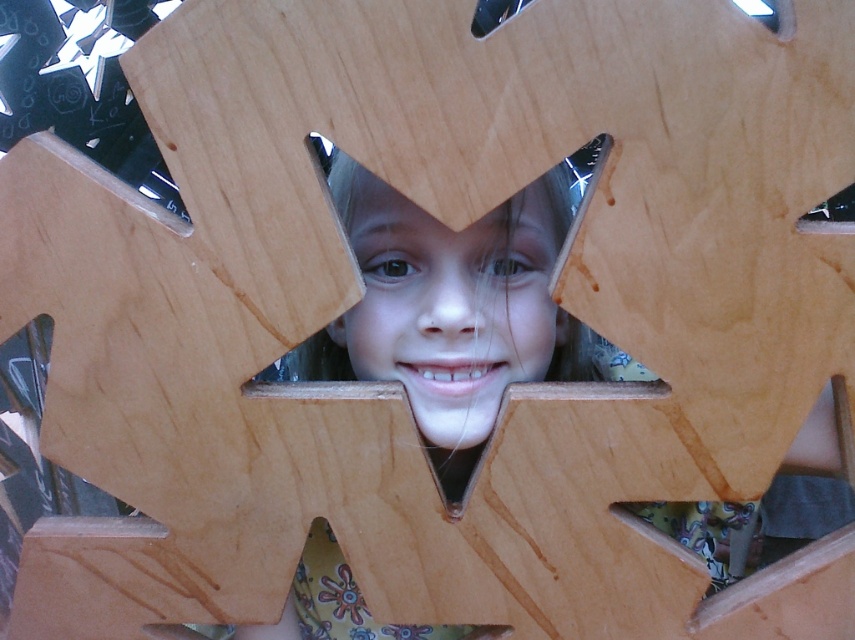
Does matte wood face at center have a larger size compared to clear plastic triangle at center?

Correct, matte wood face at center is larger in size than clear plastic triangle at center.

Who is shorter, matte wood face at center or clear plastic triangle at center?

clear plastic triangle at center is shorter.

I want to click on matte wood face at center, so click(x=453, y=310).

Is clear plastic triangle at center shorter than transparent plastic hole at upper right?

No.

You are a GUI agent. You are given a task and a screenshot of the screen. Output one action in this format:
    pyautogui.click(x=<x>, y=<y>)
    Task: Click on the clear plastic triangle at center
    
    Given the screenshot: What is the action you would take?
    click(x=830, y=214)

Is point (842, 188) farther from viewer compared to point (774, 33)?

Yes, it is behind point (774, 33).

Identify the location of clear plastic triangle at center. (830, 214).

How distant is transparent plastic hole at upper right from metallic silver at upper center?

The distance of transparent plastic hole at upper right from metallic silver at upper center is 7.82 inches.

At what (x,y) coordinates should I click in order to perform the action: click on transparent plastic hole at upper right. Please return your answer as a coordinate pair (x, y). Looking at the image, I should click on (770, 13).